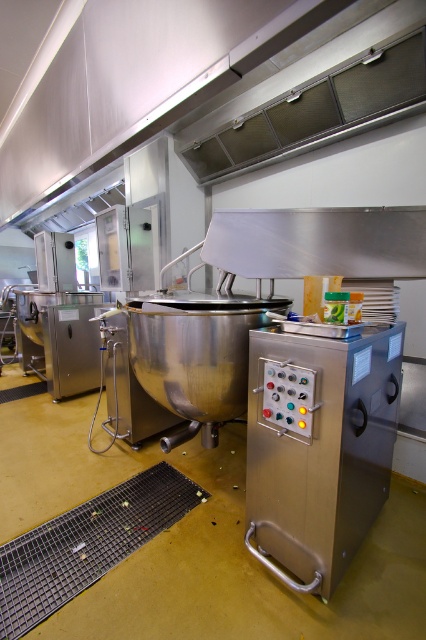
You are a maintenance worker in the commercial kitchen. You need to reach a point marked at coordinates point (311,125) to perform a repair. Your ladder is 2.5 meters long. Can you safely reach that point with your current ladder?

The distance of point (311,125) from the camera is 3.05 meters. Since the ladder is only 2.5 meters long, it is not long enough to safely reach the point at 3.05 meters away.

You are an engineer inspecting the industrial kitchen layout. You need to install a new sensor that requires 30 cm of space on either side. The sensor must be placed between the stainless steel control panel at center and the satin silver exhaust hood at upper center. Given their widths, will there be enough space for the sensor installation?

The stainless steel control panel at center has a lesser width compared to the satin silver exhaust hood at upper center. However, the exact widths are not provided, so it is impossible to determine if there is sufficient space for the sensor requiring 30 cm on each side between them.